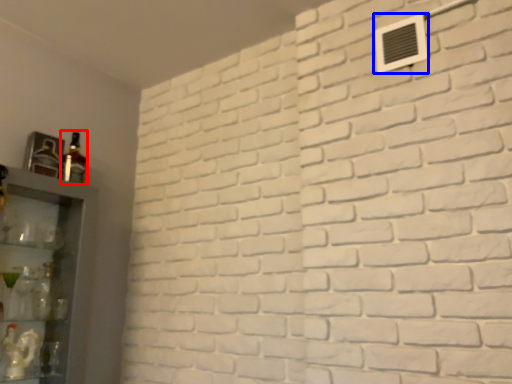
Question: Which point is further to the camera, bottle (highlighted by a red box) or air conditioning (highlighted by a blue box)?

Choices:
 (A) bottle
 (B) air conditioning

Answer: (A)